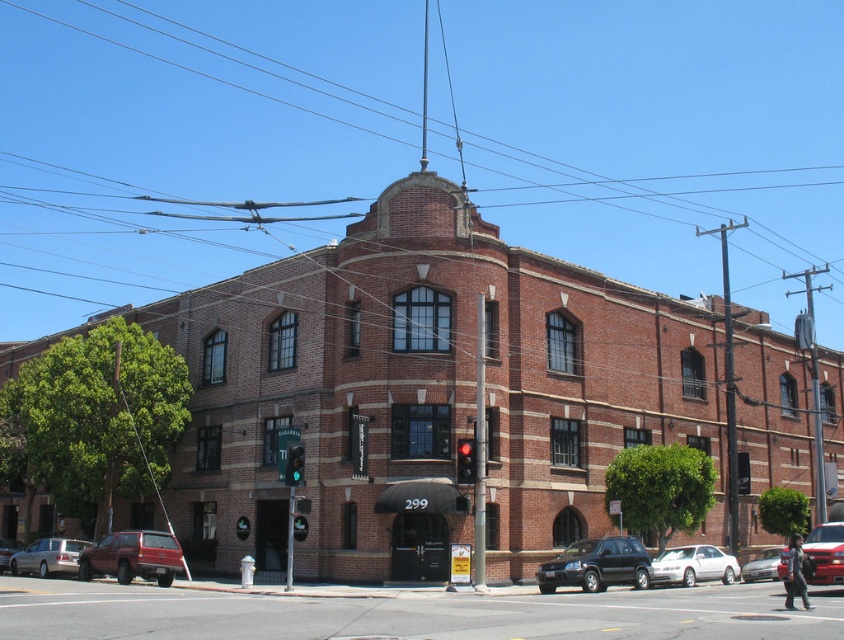
Question: Is metallic silver van at center closer to camera compared to metallic red car at lower left?

Choices:
 (A) no
 (B) yes

Answer: (B)

Question: Among these objects, which one is farthest from the camera?

Choices:
 (A) metallic red car at lower left
 (B) silver metallic sedan at center

Answer: (A)

Question: Does matte red suv at lower left appear on the left side of red glass traffic light at center?

Choices:
 (A) yes
 (B) no

Answer: (A)

Question: Which point is farther to the camera?

Choices:
 (A) (298, 481)
 (B) (172, 556)

Answer: (B)

Question: Observing the image, what is the correct spatial positioning of shiny black suv at center in reference to green glass traffic light at center?

Choices:
 (A) left
 (B) right

Answer: (B)

Question: Which point is closer to the camera taking this photo?

Choices:
 (A) (552, 564)
 (B) (17, 540)

Answer: (A)